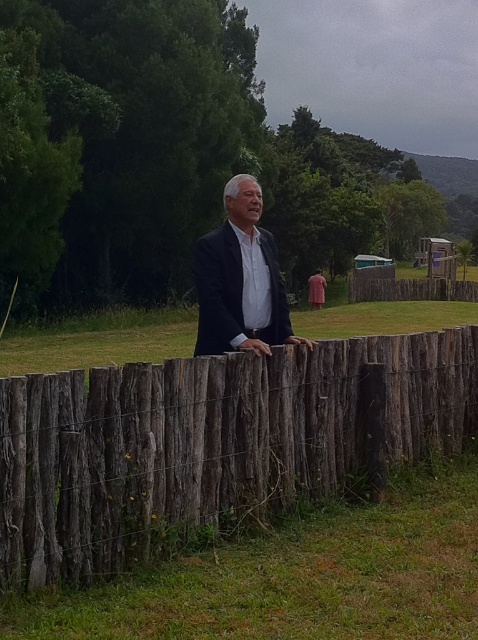
Question: Is the position of weathered wood fence at center more distant than that of pink fabric at center?

Choices:
 (A) no
 (B) yes

Answer: (A)

Question: Which object appears closest to the camera in this image?

Choices:
 (A) weathered wood fence at center
 (B) matte black suit at center
 (C) pink fabric at center

Answer: (A)

Question: Is matte black suit at center below pink fabric at center?

Choices:
 (A) no
 (B) yes

Answer: (B)

Question: Which object is the closest to the matte black suit at center?

Choices:
 (A) pink fabric at center
 (B) weathered wood fence at center

Answer: (B)

Question: Does weathered wood fence at center appear on the left side of matte black suit at center?

Choices:
 (A) no
 (B) yes

Answer: (A)

Question: Among these objects, which one is farthest from the camera?

Choices:
 (A) weathered wood fence at center
 (B) pink fabric at center

Answer: (B)